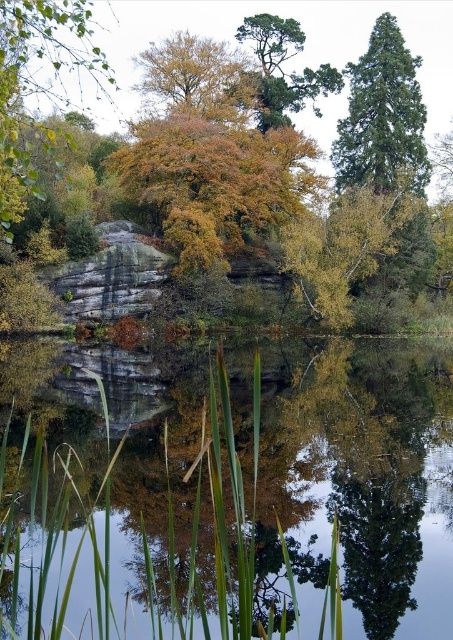
Question: Is golden yellow leaves at upper center below green textured pine tree at upper center?

Choices:
 (A) no
 (B) yes

Answer: (B)

Question: Can you confirm if transparent glass water at center is positioned to the left of golden yellow leaves at upper center?

Choices:
 (A) no
 (B) yes

Answer: (A)

Question: Which is farther from the green textured pine tree at upper center?

Choices:
 (A) golden textured leaves at upper left
 (B) green textured tree at upper right
 (C) golden yellow leaves at upper center
 (D) transparent glass water at center

Answer: (D)

Question: Which object is farther from the camera taking this photo?

Choices:
 (A) golden textured leaves at upper left
 (B) golden yellow leaves at upper center
 (C) transparent glass water at center

Answer: (B)

Question: Which point appears closest to the camera in this image?

Choices:
 (A) (163, 56)
 (B) (51, 76)
 (C) (215, 364)

Answer: (C)

Question: Does transparent glass water at center appear over golden yellow leaves at upper center?

Choices:
 (A) no
 (B) yes

Answer: (A)